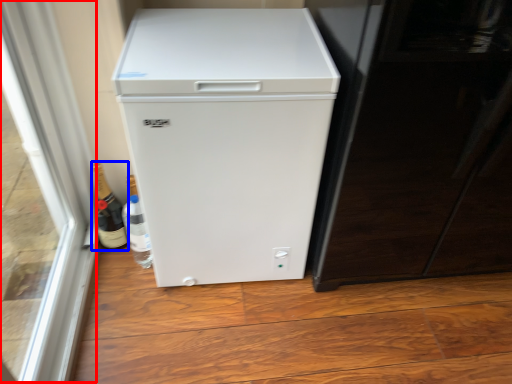
Question: Which object is further to the camera taking this photo, glass door (highlighted by a red box) or bottle (highlighted by a blue box)?

Choices:
 (A) glass door
 (B) bottle

Answer: (B)